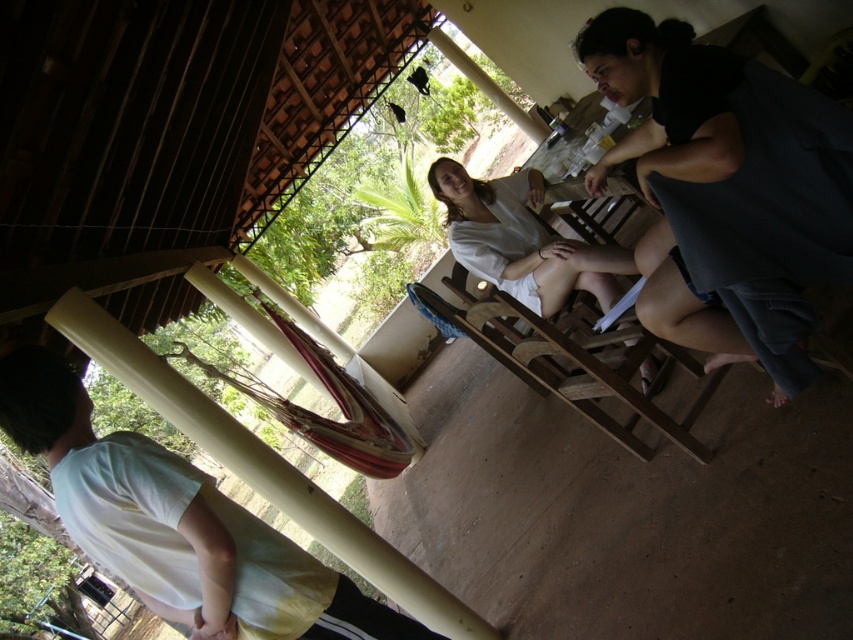
Is black cotton shorts at right taller than white cotton shirt at lower left?

Yes.

Is black cotton shorts at right smaller than white cotton shirt at lower left?

No, black cotton shorts at right is not smaller than white cotton shirt at lower left.

What do you see at coordinates (728, 189) in the screenshot? This screenshot has width=853, height=640. I see `black cotton shorts at right` at bounding box center [728, 189].

You are a GUI agent. You are given a task and a screenshot of the screen. Output one action in this format:
    pyautogui.click(x=<x>, y=<y>)
    Task: Click on the black cotton shorts at right
    
    Given the screenshot: What is the action you would take?
    pyautogui.click(x=728, y=189)

Who is higher up, black cotton shorts at right or white cotton shirt at center?

white cotton shirt at center is above.

Is black cotton shorts at right thinner than white cotton shirt at center?

Yes, black cotton shorts at right is thinner than white cotton shirt at center.

What do you see at coordinates (728, 189) in the screenshot? Image resolution: width=853 pixels, height=640 pixels. I see `black cotton shorts at right` at bounding box center [728, 189].

This screenshot has width=853, height=640. In order to click on black cotton shorts at right in this screenshot , I will do `click(728, 189)`.

Does white cotton shirt at lower left appear over white cotton shirt at center?

Actually, white cotton shirt at lower left is below white cotton shirt at center.

This screenshot has width=853, height=640. Find the location of `white cotton shirt at lower left`. white cotton shirt at lower left is located at coordinates (177, 524).